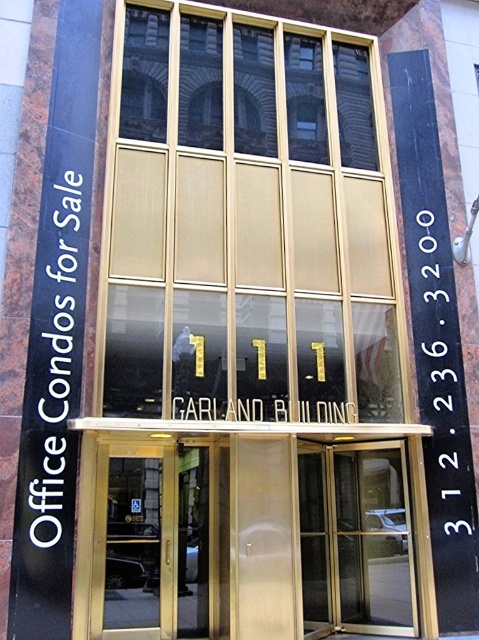
Question: Can you confirm if gold glass doors at center is thinner than transparent glass door at center?

Choices:
 (A) yes
 (B) no

Answer: (B)

Question: Can you confirm if gold metallic doors at center is bigger than gold glass doors at center?

Choices:
 (A) no
 (B) yes

Answer: (B)

Question: Which of the following is the closest to the observer?

Choices:
 (A) transparent glass door at center
 (B) gold metallic doors at center
 (C) gold frosted glass at center
 (D) gold glass doors at center

Answer: (B)

Question: Is gold frosted glass at center below transparent glass door at center?

Choices:
 (A) no
 (B) yes

Answer: (A)

Question: Which point is farther from the camera taking this photo?

Choices:
 (A) (380, 163)
 (B) (174, 456)
 (C) (91, 620)

Answer: (A)

Question: Estimate the real-world distances between objects in this image. Which object is closer to the transparent glass door at center?

Choices:
 (A) gold metallic doors at center
 (B) gold frosted glass at center

Answer: (A)